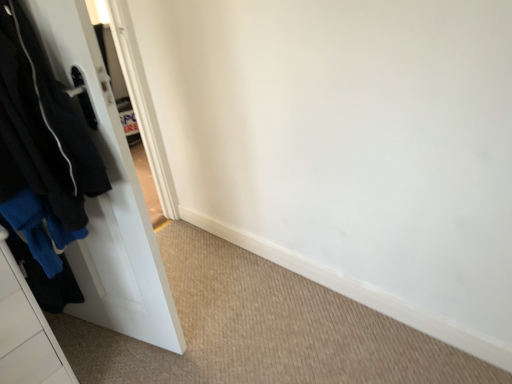
This screenshot has height=384, width=512. I want to click on white matte door at left, so click(109, 198).

Measure the distance between white matte door at left and camera.

white matte door at left and camera are 36.31 inches apart.

Describe the element at coordinates (109, 198) in the screenshot. I see `white matte door at left` at that location.

The height and width of the screenshot is (384, 512). What do you see at coordinates (42, 135) in the screenshot?
I see `black matte jacket at left` at bounding box center [42, 135].

This screenshot has height=384, width=512. I want to click on black matte jacket at left, so point(42,135).

Locate an element on the screen. white matte door at left is located at coordinates (109, 198).

Which is more to the left, white matte door at left or black matte jacket at left?

black matte jacket at left.

Does white matte door at left come in front of black matte jacket at left?

No, white matte door at left is further to the viewer.

Between point (91, 99) and point (12, 102), which one is positioned in front?

The point (12, 102) is closer to the camera.

From the image's perspective, which is above, white matte door at left or black matte jacket at left?

black matte jacket at left, from the image's perspective.

Based on the photo, from a real-world perspective, is white matte door at left physically below black matte jacket at left?

Yes, from a real-world perspective, white matte door at left is below black matte jacket at left.

Does white matte door at left have a greater width compared to black matte jacket at left?

In fact, white matte door at left might be narrower than black matte jacket at left.

Between white matte door at left and black matte jacket at left, which one has more height?

Standing taller between the two is white matte door at left.

Is white matte door at left bigger than black matte jacket at left?

Yes, white matte door at left is bigger than black matte jacket at left.

Can black matte jacket at left be found inside white matte door at left?

Definitely not — black matte jacket at left is not inside white matte door at left.

Is white matte door at left with black matte jacket at left?

No, white matte door at left is not next to black matte jacket at left.

Is white matte door at left turned away from black matte jacket at left?

Yes, white matte door at left's orientation is away from black matte jacket at left.

How many degrees apart are the facing directions of white matte door at left and black matte jacket at left?

They differ by 0.151 degrees in their facing directions.

Measure the distance between white matte door at left and black matte jacket at left.

A distance of 18.05 centimeters exists between white matte door at left and black matte jacket at left.

You are a GUI agent. You are given a task and a screenshot of the screen. Output one action in this format:
    pyautogui.click(x=<x>, y=<y>)
    Task: Click on the clothing above the white matte door at left (from a real-world perspective)
    
    Given the screenshot: What is the action you would take?
    pyautogui.click(x=42, y=135)

Between black matte jacket at left and white matte door at left, which one appears on the left side from the viewer's perspective?

Positioned to the left is black matte jacket at left.

Which object is more forward, black matte jacket at left or white matte door at left?

black matte jacket at left is in front.

Considering the positions of point (69, 136) and point (90, 68), is point (69, 136) closer or farther from the camera than point (90, 68)?

Clearly, point (69, 136) is more distant from the camera than point (90, 68).

Based on the photo, from the image's perspective, between black matte jacket at left and white matte door at left, who is located below?

From the image's view, white matte door at left is below.

From a real-world perspective, is black matte jacket at left on top of white matte door at left?

Yes, from a real-world perspective, black matte jacket at left is above white matte door at left.

Which of these two, black matte jacket at left or white matte door at left, is thinner?

white matte door at left is thinner.

Does black matte jacket at left have a greater height compared to white matte door at left?

In fact, black matte jacket at left may be shorter than white matte door at left.

Considering the relative sizes of black matte jacket at left and white matte door at left in the image provided, is black matte jacket at left bigger than white matte door at left?

No, black matte jacket at left is not bigger than white matte door at left.

Is black matte jacket at left inside or outside of white matte door at left?

black matte jacket at left is spatially situated outside white matte door at left.

Is black matte jacket at left next to white matte door at left?

No, black matte jacket at left is not making contact with white matte door at left.

Is white matte door at left at the back of black matte jacket at left?

Absolutely, black matte jacket at left is directed away from white matte door at left.

How different are the orientations of black matte jacket at left and white matte door at left in degrees?

There is a 0.151-degree angle between the facing directions of black matte jacket at left and white matte door at left.

Where is `door behind the black matte jacket at left`? This screenshot has width=512, height=384. door behind the black matte jacket at left is located at coordinates (109, 198).

In order to click on door behind the black matte jacket at left in this screenshot , I will do `click(109, 198)`.

Find the location of a particular element. The height and width of the screenshot is (384, 512). clothing on the left of white matte door at left is located at coordinates (42, 135).